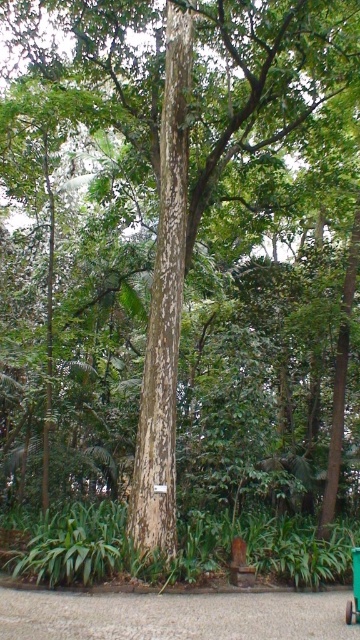
In the scene shown: Is speckled bark tree trunk at center below green plastic cart at center?

Actually, speckled bark tree trunk at center is above green plastic cart at center.

Is speckled bark tree trunk at center smaller than green plastic cart at center?

Yes, speckled bark tree trunk at center is smaller than green plastic cart at center.

Does point (163, 337) lie behind point (358, 576)?

That is True.

At what (x,y) coordinates should I click in order to perform the action: click on speckled bark tree trunk at center. Please return your answer as a coordinate pair (x, y). Looking at the image, I should click on (164, 307).